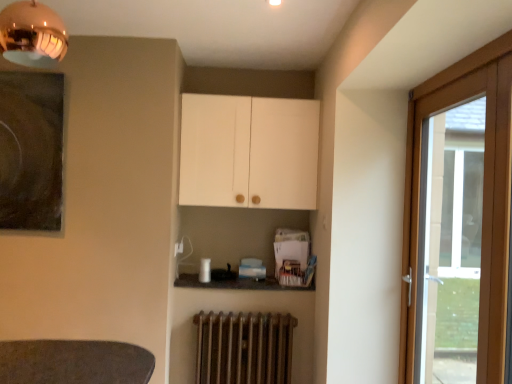
Question: Looking at their shapes, would you say granite countertop at center is wider or thinner than white matte cabinet at upper center?

Choices:
 (A) thin
 (B) wide

Answer: (A)

Question: From a real-world perspective, is granite countertop at center above or below white matte cabinet at upper center?

Choices:
 (A) above
 (B) below

Answer: (B)

Question: Which object is positioned closest to the wooden door at right?

Choices:
 (A) white matte cabinet at upper center
 (B) granite countertop at center
 (C) rusty metal radiator at lower center

Answer: (A)

Question: Estimate the real-world distances between objects in this image. Which object is closer to the granite countertop at center?

Choices:
 (A) wooden door at right
 (B) white matte cabinet at upper center
 (C) rusty metal radiator at lower center

Answer: (C)